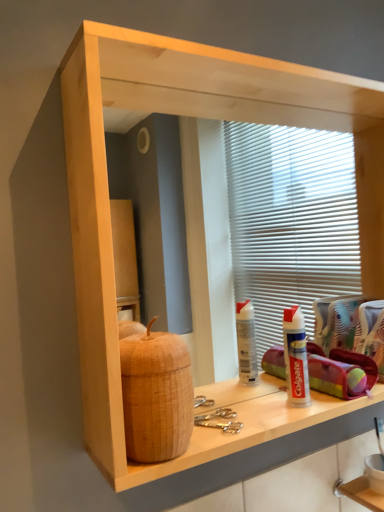
Question: Is white plastic toothpaste tube at lower right facing away from brown woven basket at left?

Choices:
 (A) yes
 (B) no

Answer: (B)

Question: Can we say white plastic toothpaste tube at lower right lies outside brown woven basket at left?

Choices:
 (A) no
 (B) yes

Answer: (B)

Question: From a real-world perspective, is white plastic toothpaste tube at lower right located beneath brown woven basket at left?

Choices:
 (A) yes
 (B) no

Answer: (A)

Question: Can you confirm if white plastic toothpaste tube at lower right is wider than brown woven basket at left?

Choices:
 (A) yes
 (B) no

Answer: (A)

Question: Are white plastic toothpaste tube at lower right and brown woven basket at left located far from each other?

Choices:
 (A) yes
 (B) no

Answer: (B)

Question: Considering the relative positions of white plastic toothpaste tube at lower right and brown woven basket at left in the image provided, is white plastic toothpaste tube at lower right to the left of brown woven basket at left from the viewer's perspective?

Choices:
 (A) no
 (B) yes

Answer: (A)

Question: From the image's perspective, is white plastic toothpaste tube at lower right under white wood shelf at lower right?

Choices:
 (A) yes
 (B) no

Answer: (B)

Question: Is white plastic toothpaste tube at lower right at the right side of white wood shelf at lower right?

Choices:
 (A) no
 (B) yes

Answer: (A)

Question: From a real-world perspective, is white plastic toothpaste tube at lower right on top of white wood shelf at lower right?

Choices:
 (A) yes
 (B) no

Answer: (A)

Question: Can you confirm if white plastic toothpaste tube at lower right is taller than white wood shelf at lower right?

Choices:
 (A) yes
 (B) no

Answer: (A)

Question: Considering the relative sizes of white plastic toothpaste tube at lower right and white wood shelf at lower right in the image provided, is white plastic toothpaste tube at lower right smaller than white wood shelf at lower right?

Choices:
 (A) yes
 (B) no

Answer: (B)

Question: From the image's perspective, is white plastic toothpaste tube at lower right located above white wood shelf at lower right?

Choices:
 (A) no
 (B) yes

Answer: (B)

Question: Can you confirm if white wood shelf at lower right is taller than white plastic toothpaste tube at lower right?

Choices:
 (A) no
 (B) yes

Answer: (A)